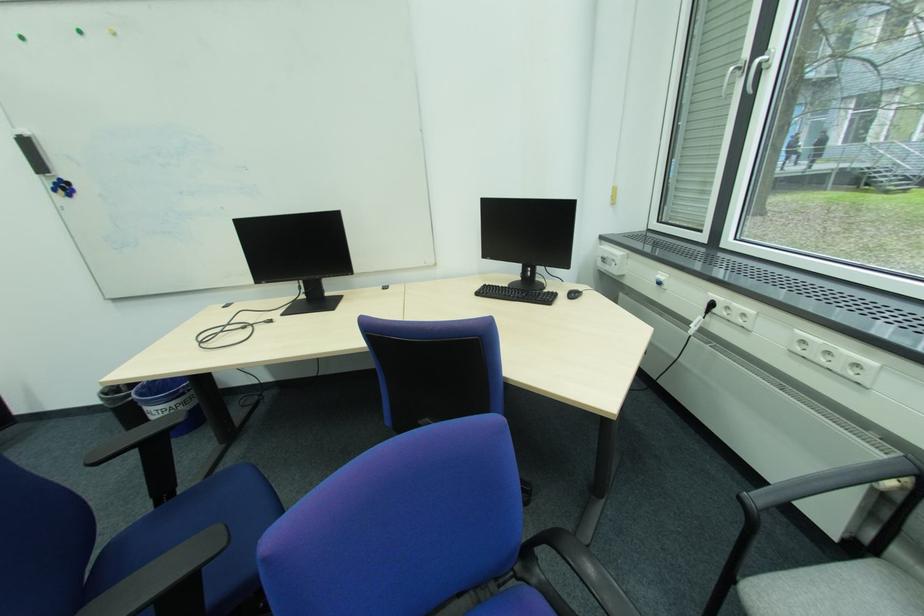
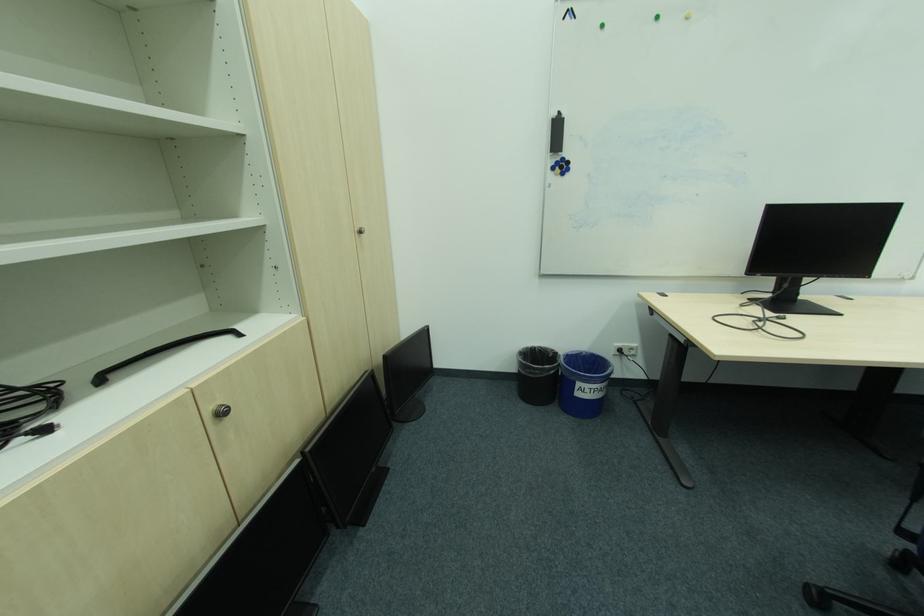
Locate, in the second image, the point that corresponds to (x=163, y=413) in the first image.

(593, 391)